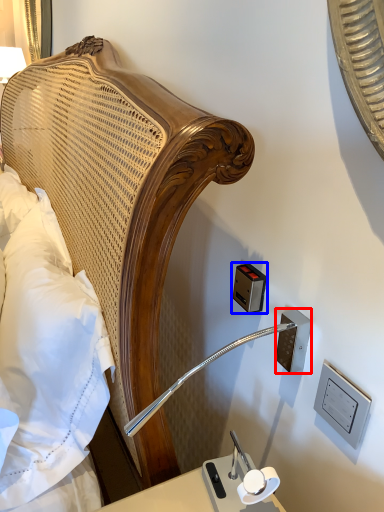
Question: Which object is further to the camera taking this photo, electric outlet (highlighted by a red box) or electric outlet (highlighted by a blue box)?

Choices:
 (A) electric outlet
 (B) electric outlet

Answer: (B)